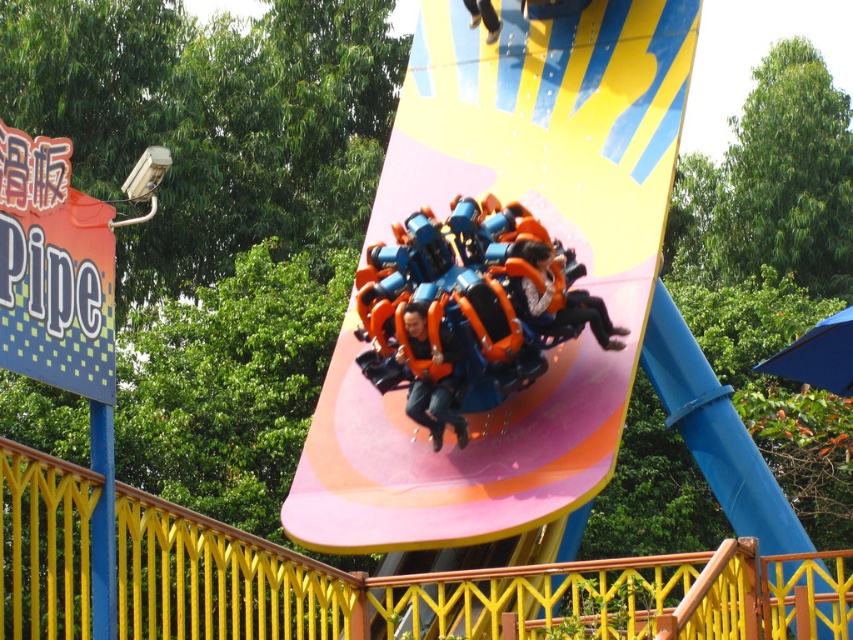
What do you see at coordinates (550, 234) in the screenshot?
I see `orange matte slide at center` at bounding box center [550, 234].

In the scene shown: Who is taller, orange matte slide at center or orange fabric seat at center?

With more height is orange matte slide at center.

Does point (575, 157) lie in front of point (457, 355)?

No.

Identify the location of orange matte slide at center. This screenshot has height=640, width=853. (550, 234).

Is orange matte slide at center behind matte orange helmet at center?

No, it is not.

You are a GUI agent. You are given a task and a screenshot of the screen. Output one action in this format:
    pyautogui.click(x=<x>, y=<y>)
    Task: Click on the orange matte slide at center
    The height and width of the screenshot is (640, 853).
    Given the screenshot: What is the action you would take?
    pyautogui.click(x=550, y=234)

Is point (368, 534) more distant than point (579, 301)?

Yes, point (368, 534) is farther from viewer.

Find the location of a particular element. orange matte slide at center is located at coordinates (550, 234).

Between orange matte roller coaster car at center and matte orange helmet at center, which one has more height?

orange matte roller coaster car at center

Is orange matte roller coaster car at center to the right of matte orange helmet at center from the viewer's perspective?

Incorrect, orange matte roller coaster car at center is not on the right side of matte orange helmet at center.

Who is more distant from viewer, (494, 308) or (604, 324)?

Positioned behind is point (604, 324).

You are a GUI agent. You are given a task and a screenshot of the screen. Output one action in this format:
    pyautogui.click(x=<x>, y=<y>)
    Task: Click on the orange matte roller coaster car at center
    
    Given the screenshot: What is the action you would take?
    pyautogui.click(x=463, y=308)